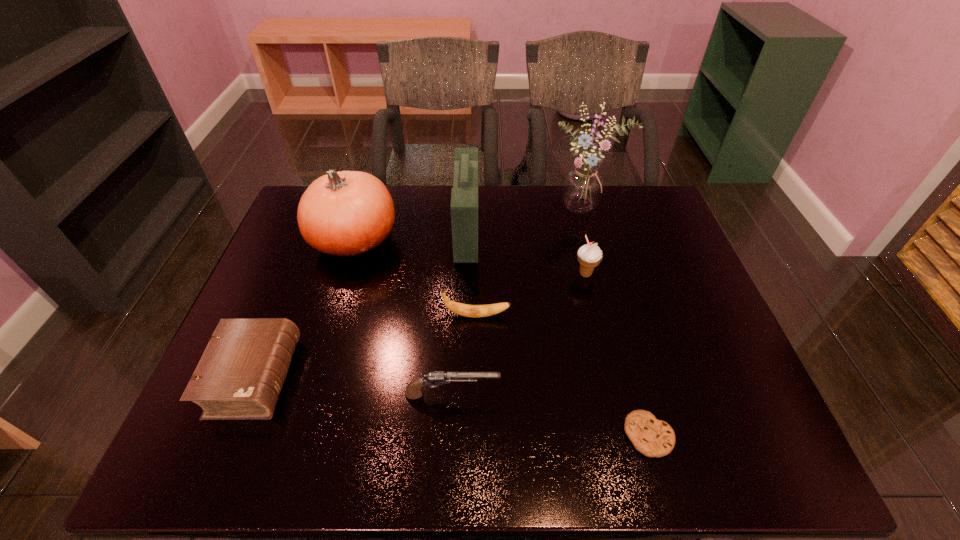
You are a GUI agent. You are given a task and a screenshot of the screen. Output one action in this format:
    pyautogui.click(x=<x>, y=<y>)
    Task: Click on the pumpkin at the left edge
    The width and height of the screenshot is (960, 540).
    Given the screenshot: What is the action you would take?
    pyautogui.click(x=348, y=213)

Where is `Bible that is positioned at the left edge`? Bible that is positioned at the left edge is located at coordinates (240, 375).

Where is `object located in the right edge section of the desktop`? Image resolution: width=960 pixels, height=540 pixels. object located in the right edge section of the desktop is located at coordinates (582, 188).

You are a GUI agent. You are given a task and a screenshot of the screen. Output one action in this format:
    pyautogui.click(x=<x>, y=<y>)
    Task: Click on the object present at the far left corner
    
    Given the screenshot: What is the action you would take?
    pyautogui.click(x=348, y=213)

Where is `object located at the far right corner`? object located at the far right corner is located at coordinates (582, 188).

At what (x,y) coordinates should I click in order to perform the action: click on vacant space at the far edge of the desktop. Please return your answer as a coordinate pair (x, y). The image size is (960, 540). Looking at the image, I should click on (557, 213).

Where is `free region at the near edge of the desktop`? Image resolution: width=960 pixels, height=540 pixels. free region at the near edge of the desktop is located at coordinates click(559, 446).

In the image, there is a desktop. Where is `vacant region at the right edge`? The image size is (960, 540). vacant region at the right edge is located at coordinates (701, 299).

In order to click on free location at the far right corner in this screenshot , I will do `click(625, 186)`.

Where is `free space between the tallest object and the gun`? Image resolution: width=960 pixels, height=540 pixels. free space between the tallest object and the gun is located at coordinates (518, 302).